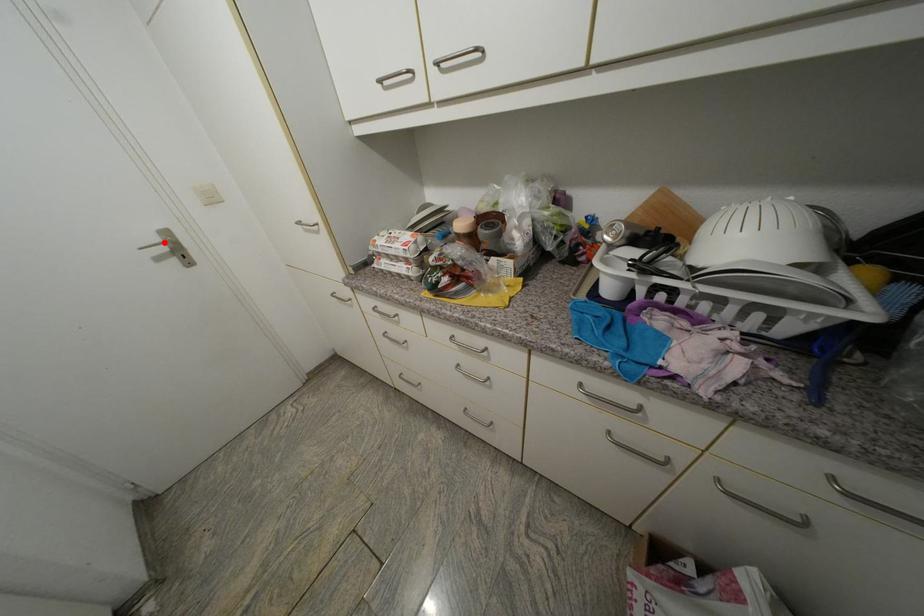
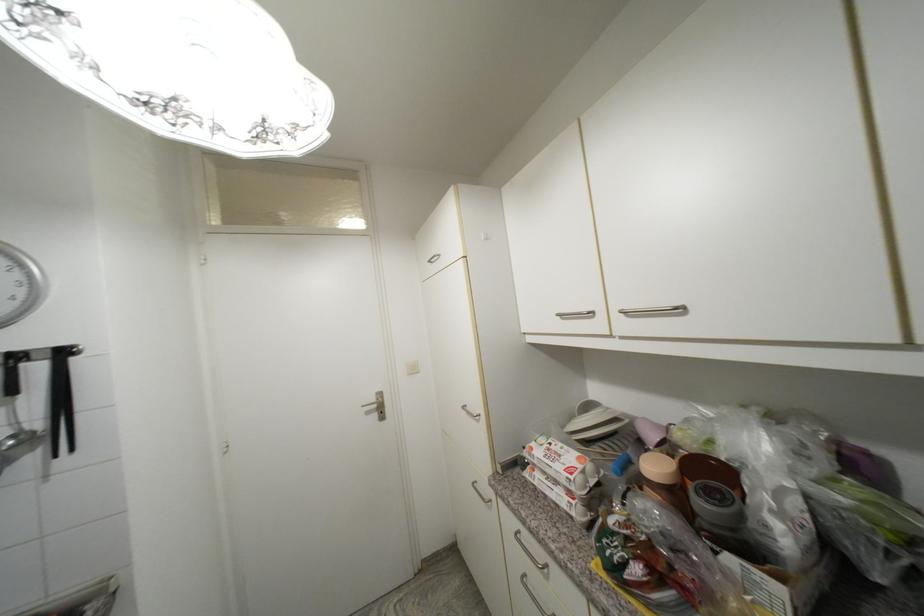
In the second image, find the point that corresponds to the highlighted location in the first image.

(380, 400)